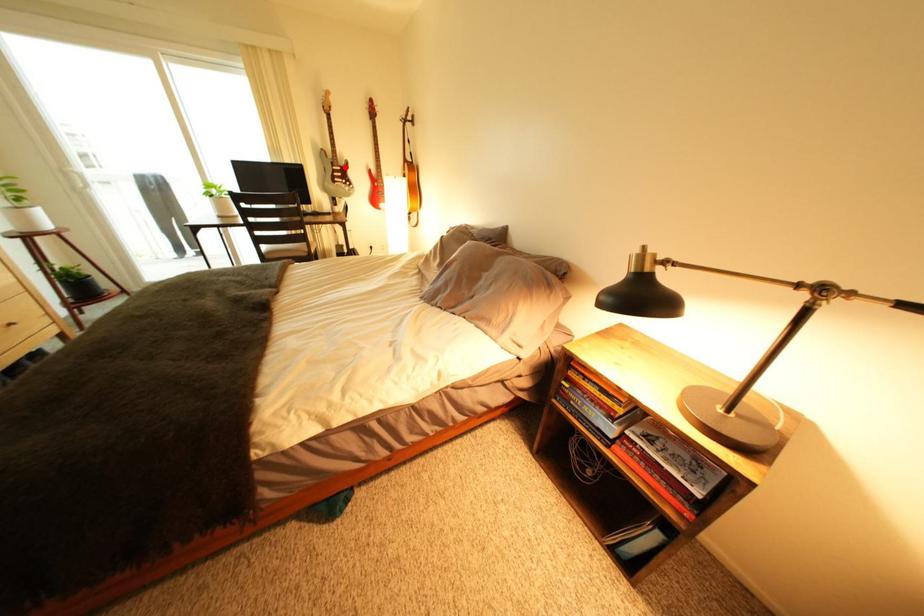
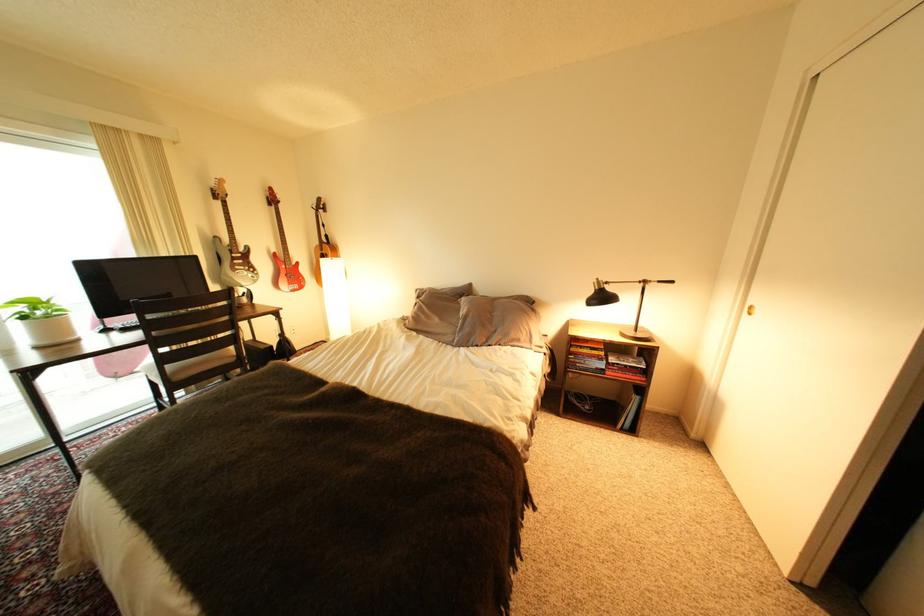
Question: I am providing you with two images of the same scene from different viewpoints. Given a red point in image1, look at the same physical point in image2. Is it:

Choices:
 (A) Closer to the viewpoint
 (B) Farther from the viewpoint

Answer: (B)